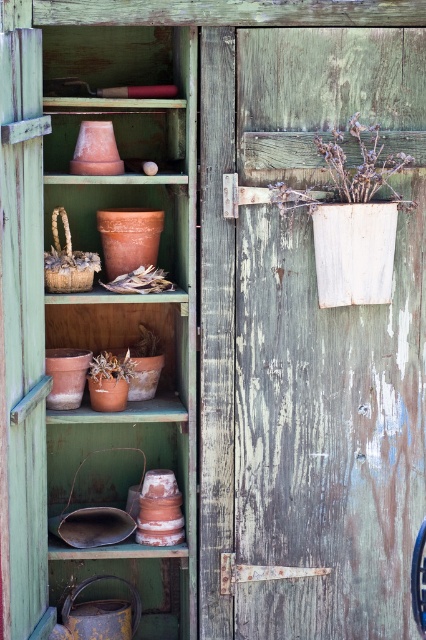
Question: Is terracotta clay pots at left below dry wood branch at upper right?

Choices:
 (A) yes
 (B) no

Answer: (A)

Question: Which point is closer to the camera?

Choices:
 (A) (353, 116)
 (B) (181, 364)

Answer: (A)

Question: Does terracotta clay pots at left have a lesser width compared to matte brown pot at lower center?

Choices:
 (A) no
 (B) yes

Answer: (A)

Question: Which object is farther from the camera taking this photo?

Choices:
 (A) matte brown pot at lower center
 (B) dry wood branch at upper right
 (C) terracotta clay pots at left

Answer: (A)

Question: Which point is farther to the camera?

Choices:
 (A) terracotta clay pots at left
 (B) dry wood branch at upper right

Answer: (B)

Question: Is dry wood branch at upper right thinner than matte brown pot at lower center?

Choices:
 (A) no
 (B) yes

Answer: (A)